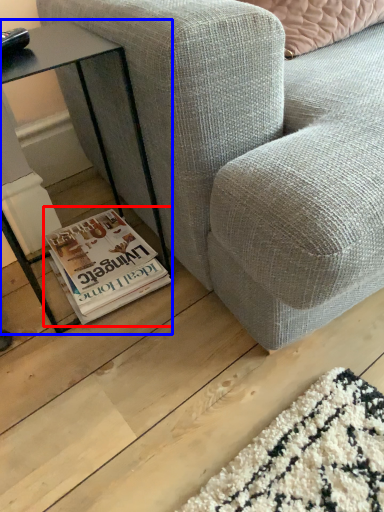
Question: Which object is closer to the camera taking this photo, paperback book (highlighted by a red box) or table (highlighted by a blue box)?

Choices:
 (A) paperback book
 (B) table

Answer: (B)